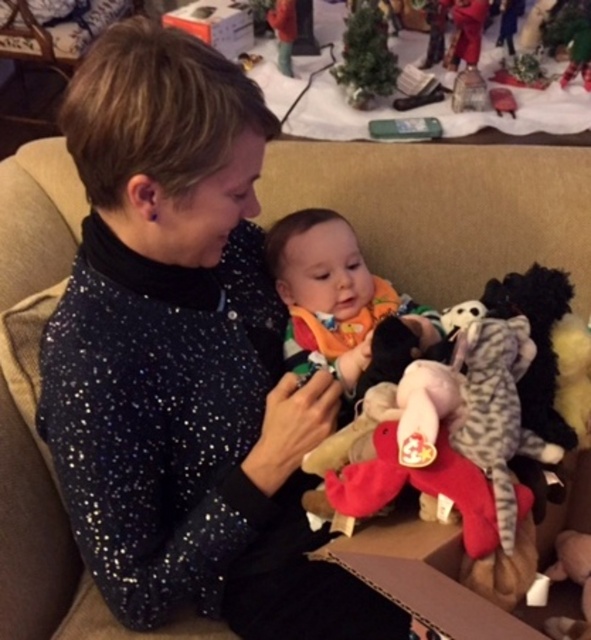
Is point (589, 56) positioned in front of point (284, 68)?

Yes, point (589, 56) is closer to viewer.

How distant is green plush toy at upper right from velvet plush toy at upper center?

A distance of 72.45 centimeters exists between green plush toy at upper right and velvet plush toy at upper center.

Identify the location of green plush toy at upper right. This screenshot has height=640, width=591. (570, 36).

Is cardboard box at lower right bigger than green plush toy at upper right?

Yes.

Find the location of `cardboard box at lower right`. cardboard box at lower right is located at coordinates (439, 577).

You are a GUI agent. You are given a task and a screenshot of the screen. Output one action in this format:
    pyautogui.click(x=<x>, y=<y>)
    Task: Click on the cardboard box at lower right
    
    Given the screenshot: What is the action you would take?
    pyautogui.click(x=439, y=577)

In the scene shown: Can you confirm if soft orange bib at center is bigger than velvet plush reindeer at upper right?

Indeed, soft orange bib at center has a larger size compared to velvet plush reindeer at upper right.

Is soft orange bib at center to the left of velvet plush reindeer at upper right from the viewer's perspective?

Correct, you'll find soft orange bib at center to the left of velvet plush reindeer at upper right.

Is point (285, 241) less distant than point (449, 67)?

Yes, point (285, 241) is closer to viewer.

Find the location of a particular element. The width and height of the screenshot is (591, 640). soft orange bib at center is located at coordinates (336, 291).